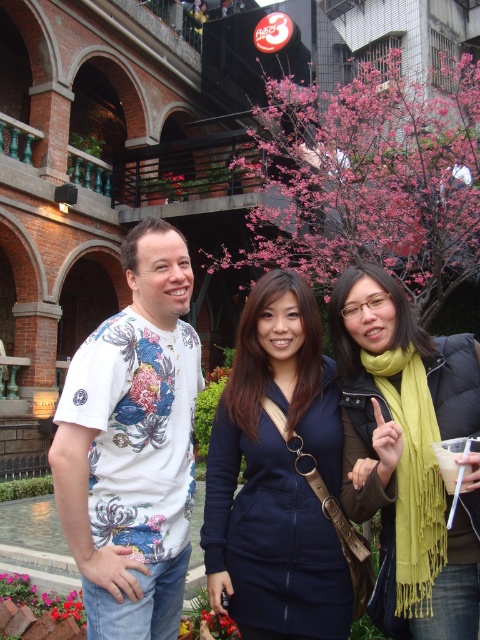
Question: Which point is farther from the camera taking this photo?

Choices:
 (A) (445, 474)
 (B) (275, 282)
 (C) (97, 340)

Answer: (B)

Question: Among these objects, which one is nearest to the camera?

Choices:
 (A) floral printed t-shirt at left
 (B) green scarf at center

Answer: (B)

Question: Is floral printed t-shirt at left smaller than white paper cup at lower right?

Choices:
 (A) no
 (B) yes

Answer: (A)

Question: Does white floral t-shirt at left have a larger size compared to green scarf at center?

Choices:
 (A) no
 (B) yes

Answer: (B)

Question: Which of the following is the farthest from the observer?

Choices:
 (A) white floral t-shirt at left
 (B) floral printed t-shirt at left
 (C) navy blue fabric dress at center
 (D) green scarf at center

Answer: (C)

Question: Can you confirm if green scarf at center is positioned above white paper cup at lower right?

Choices:
 (A) no
 (B) yes

Answer: (B)